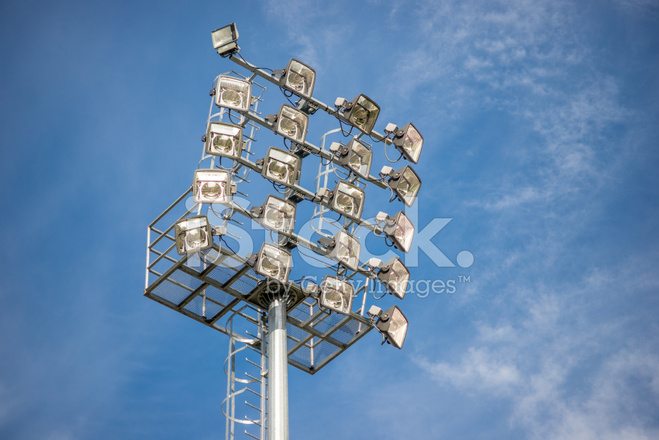
Locate an element on the screen. This screenshot has width=659, height=440. top row of lights is located at coordinates (221, 34), (304, 80), (364, 108), (409, 135).